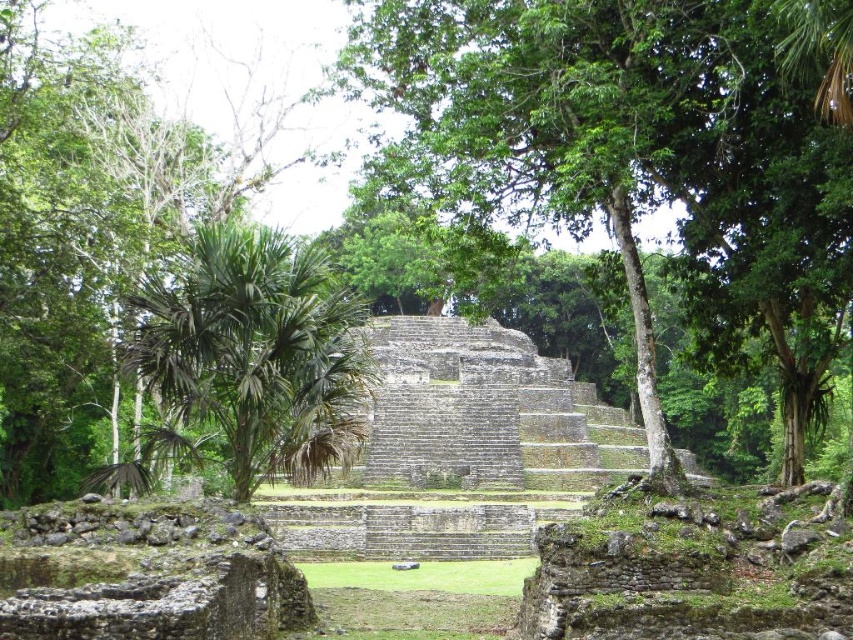
Does point (619, 196) come behind point (206, 380)?

That is True.

Is green leafy tree at center taller than green leafy palm tree at center?

Correct, green leafy tree at center is much taller as green leafy palm tree at center.

Describe the element at coordinates (648, 150) in the screenshot. I see `green leafy tree at center` at that location.

Image resolution: width=853 pixels, height=640 pixels. What are the coordinates of `green leafy tree at center` in the screenshot? It's located at (648, 150).